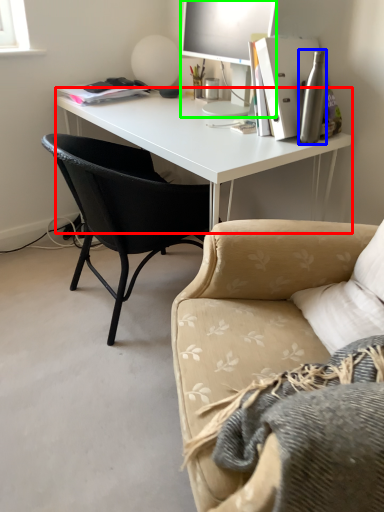
Question: Estimate the real-world distances between objects in this image. Which object is closer to desk (highlighted by a red box), bottle (highlighted by a blue box) or television (highlighted by a green box)?

Choices:
 (A) bottle
 (B) television

Answer: (B)